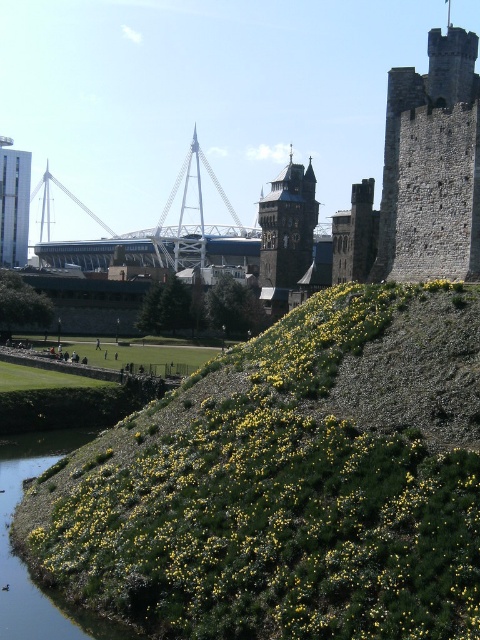
Is point (348, 612) less distant than point (310, 164)?

Yes, it is.

Is green leafy shrub at lower center positioned in front of dark brown stone tower at center?

Yes, it is.

Measure the distance between point [477,525] and camera.

Point [477,525] is 34.46 meters from camera.

Where is `green leafy shrub at lower center`? green leafy shrub at lower center is located at coordinates pos(288,483).

Does stone tower at upper right appear on the right side of dark brown stone tower at center?

Indeed, stone tower at upper right is positioned on the right side of dark brown stone tower at center.

Does point (414, 196) lie behind point (299, 168)?

No, (414, 196) is closer to viewer.

Locate an element on the screen. The width and height of the screenshot is (480, 640). stone tower at upper right is located at coordinates (x=428, y=170).

From the picture: Is green leafy shrub at lower center below smooth white tower at left?

Yes, green leafy shrub at lower center is below smooth white tower at left.

Does green leafy shrub at lower center come behind smooth white tower at left?

No, it is in front of smooth white tower at left.

Which is in front, point (178, 586) or point (24, 192)?

Point (178, 586) is in front.

Identify the location of green leafy shrub at lower center. (288, 483).